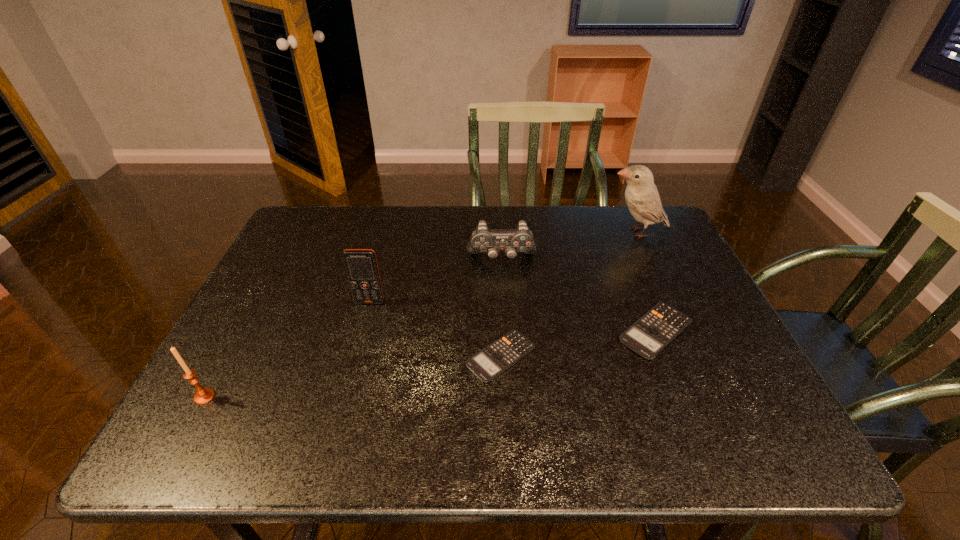
This screenshot has height=540, width=960. I want to click on the nearest object, so click(203, 395).

Identify the location of vacant space located on the back of the left calculator. (498, 281).

The width and height of the screenshot is (960, 540). Find the location of `vacant space located 0.060m on the back of the taller calculator`. vacant space located 0.060m on the back of the taller calculator is located at coordinates (638, 287).

Find the location of `free space located 0.280m at the face of the tallest object`. free space located 0.280m at the face of the tallest object is located at coordinates (514, 232).

Locate an element on the screen. This screenshot has height=540, width=960. vacant space located at the face of the tallest object is located at coordinates (565, 232).

Image resolution: width=960 pixels, height=540 pixels. In order to click on vacant area situated at the face of the tallest object in this screenshot , I will do `click(556, 232)`.

Locate an element on the screen. The image size is (960, 540). vacant region located 0.090m on the screen of the cellular telephone is located at coordinates (362, 332).

This screenshot has width=960, height=540. Identify the location of blank area located on the surface of the control with buttons. coord(505,319).

Locate an element on the screen. Image resolution: width=960 pixels, height=540 pixels. blank area located 0.390m on the back of the nearest object is located at coordinates (274, 269).

The width and height of the screenshot is (960, 540). I want to click on object that is at the far edge, so click(641, 195).